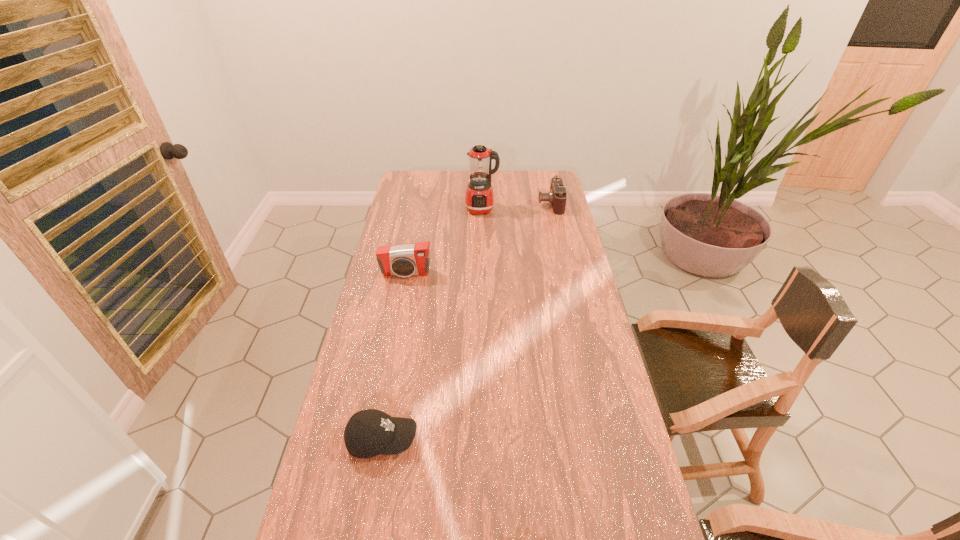
You are a GUI agent. You are given a task and a screenshot of the screen. Output one action in this format:
    pyautogui.click(x=<x>, y=<y>)
    Task: Click on the vacant position located 0.200m on the front-facing side of the farther camera
    
    Given the screenshot: What is the action you would take?
    pyautogui.click(x=496, y=204)

You are a GUI agent. You are given a task and a screenshot of the screen. Output one action in this format:
    pyautogui.click(x=<x>, y=<y>)
    Task: Click on the free space located 0.280m on the front-facing side of the farther camera
    The width and height of the screenshot is (960, 540).
    Given the screenshot: What is the action you would take?
    pyautogui.click(x=479, y=204)

Identify the location of vacant space located 0.060m on the front-facing side of the baseball cap. Image resolution: width=960 pixels, height=540 pixels. (441, 440).

Find the location of a particular element. object at the far edge is located at coordinates (557, 196).

The image size is (960, 540). I want to click on camera positioned at the left edge, so click(413, 259).

Identify the location of baseball cap that is at the left edge. (370, 432).

You are a GUI agent. You are given a task and a screenshot of the screen. Output one action in this format:
    pyautogui.click(x=<x>, y=<y>)
    Task: Click on the object that is at the right edge
    The image size is (960, 540).
    Given the screenshot: What is the action you would take?
    pyautogui.click(x=557, y=196)

This screenshot has width=960, height=540. Identify the location of object at the far right corner. click(x=557, y=196).

Where is `vacant space at the far edge of the desktop`? vacant space at the far edge of the desktop is located at coordinates (462, 185).

I want to click on free space at the left edge of the desktop, so click(x=377, y=500).